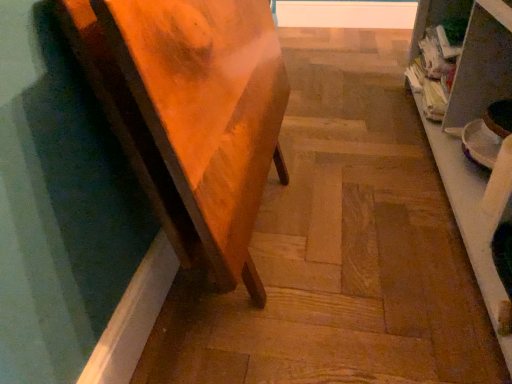
Question: Is wooden table at left positioned in front of wooden step at center?

Choices:
 (A) no
 (B) yes

Answer: (B)

Question: Considering the relative sizes of wooden table at left and wooden step at center in the image provided, is wooden table at left taller than wooden step at center?

Choices:
 (A) yes
 (B) no

Answer: (A)

Question: Can you confirm if wooden table at left is smaller than wooden step at center?

Choices:
 (A) no
 (B) yes

Answer: (A)

Question: From a real-world perspective, does wooden table at left sit lower than wooden step at center?

Choices:
 (A) yes
 (B) no

Answer: (B)

Question: Considering the relative sizes of wooden table at left and wooden step at center in the image provided, is wooden table at left shorter than wooden step at center?

Choices:
 (A) yes
 (B) no

Answer: (B)

Question: In the image, is wooden step at center positioned in front of or behind white glossy shelf at right?

Choices:
 (A) front
 (B) behind

Answer: (B)

Question: Considering the positions of wooden step at center and white glossy shelf at right in the image, is wooden step at center taller or shorter than white glossy shelf at right?

Choices:
 (A) tall
 (B) short

Answer: (B)

Question: Considering the relative positions of wooden step at center and white glossy shelf at right in the image provided, is wooden step at center to the left or to the right of white glossy shelf at right?

Choices:
 (A) right
 (B) left

Answer: (B)

Question: From a real-world perspective, relative to white glossy shelf at right, is wooden step at center vertically above or below?

Choices:
 (A) below
 (B) above

Answer: (A)

Question: In terms of width, does wooden step at center look wider or thinner when compared to wooden table at left?

Choices:
 (A) wide
 (B) thin

Answer: (A)

Question: From a real-world perspective, is wooden step at center above or below wooden table at left?

Choices:
 (A) below
 (B) above

Answer: (A)

Question: Considering the positions of point (296, 256) and point (189, 196), is point (296, 256) closer or farther from the camera than point (189, 196)?

Choices:
 (A) closer
 (B) farther

Answer: (B)

Question: Considering the positions of wooden step at center and wooden table at left in the image, is wooden step at center taller or shorter than wooden table at left?

Choices:
 (A) tall
 (B) short

Answer: (B)

Question: Considering the positions of white glossy shelf at right and wooden step at center in the image, is white glossy shelf at right wider or thinner than wooden step at center?

Choices:
 (A) wide
 (B) thin

Answer: (B)

Question: From the image's perspective, relative to wooden step at center, is white glossy shelf at right above or below?

Choices:
 (A) below
 (B) above

Answer: (A)